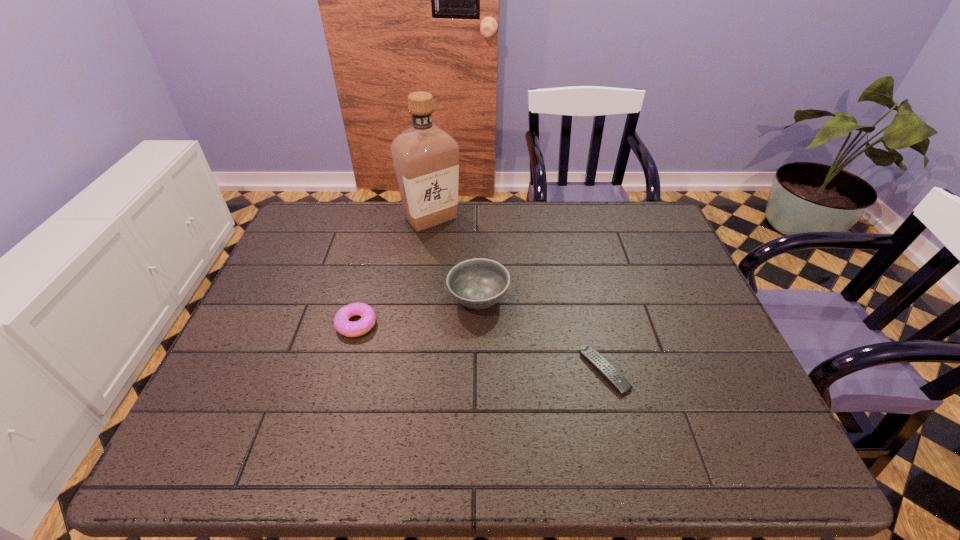
The width and height of the screenshot is (960, 540). In order to click on free space located on the right of the nearest object in this screenshot , I will do `click(692, 371)`.

Identify the location of object that is at the far edge. Image resolution: width=960 pixels, height=540 pixels. (426, 159).

You are a GUI agent. You are given a task and a screenshot of the screen. Output one action in this format:
    pyautogui.click(x=<x>, y=<y>)
    Task: Click on the vacant space at the far edge of the desktop
    
    Given the screenshot: What is the action you would take?
    pyautogui.click(x=345, y=238)

The width and height of the screenshot is (960, 540). Identify the location of vacant position at the near edge of the desktop. (424, 432).

Identify the location of free region at the left edge. (283, 306).

Locate an element on the screen. The image size is (960, 540). vacant space at the right edge of the desktop is located at coordinates (647, 306).

Locate an element on the screen. vacant position at the far left corner of the desktop is located at coordinates (308, 230).

I want to click on vacant space at the near left corner of the desktop, so click(184, 468).

Locate an element on the screen. The width and height of the screenshot is (960, 540). vacant point located between the rightmost object and the farthest object is located at coordinates (517, 295).

Identify the location of free space that is in between the liquor and the third tallest object. point(394,271).